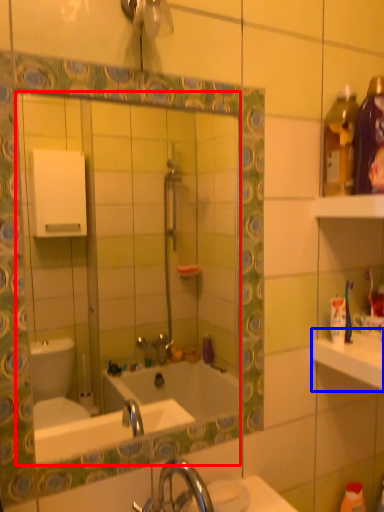
Question: Which point is closer to the camera, mirror (highlighted by a red box) or counter top (highlighted by a blue box)?

Choices:
 (A) mirror
 (B) counter top

Answer: (A)